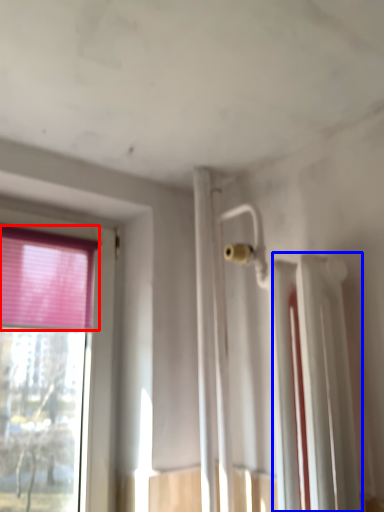
Question: Which of the following is the farthest to the observer, curtain (highlighted by a red box) or radiator (highlighted by a blue box)?

Choices:
 (A) curtain
 (B) radiator

Answer: (A)